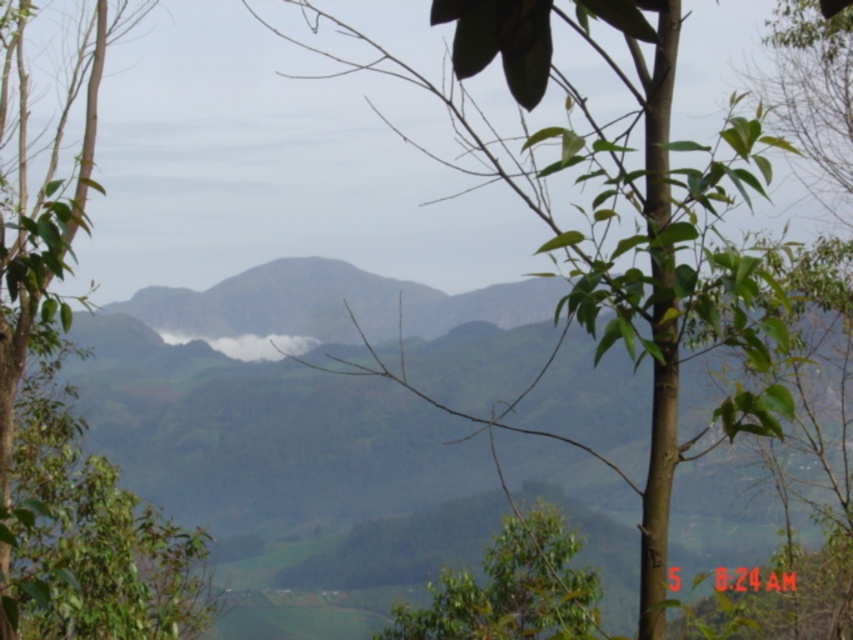
Who is taller, green leafy tree at center or green leafy tree at left?

Standing taller between the two is green leafy tree at center.

Who is more distant from viewer, (641, 545) or (85, 465)?

Positioned behind is point (85, 465).

Where is `green leafy tree at center`? green leafy tree at center is located at coordinates (621, 218).

Find the location of a particular element. This screenshot has width=853, height=640. green leafy tree at center is located at coordinates (621, 218).

Who is positioned more to the right, green leafy tree at center or white foggy cloud at center?

Positioned to the right is green leafy tree at center.

Does green leafy tree at center lie behind white foggy cloud at center?

No, green leafy tree at center is closer to the viewer.

Does point (604, 323) come behind point (270, 348)?

No, it is in front of (270, 348).

The width and height of the screenshot is (853, 640). Identify the location of green leafy tree at center. (621, 218).

Is green leafy tree at left smaller than white foggy cloud at center?

Yes.

Is the position of green leafy tree at left more distant than that of white foggy cloud at center?

No, green leafy tree at left is in front of white foggy cloud at center.

Locate an element on the screen. green leafy tree at left is located at coordinates (68, 403).

I want to click on green leafy tree at left, so pyautogui.click(x=68, y=403).